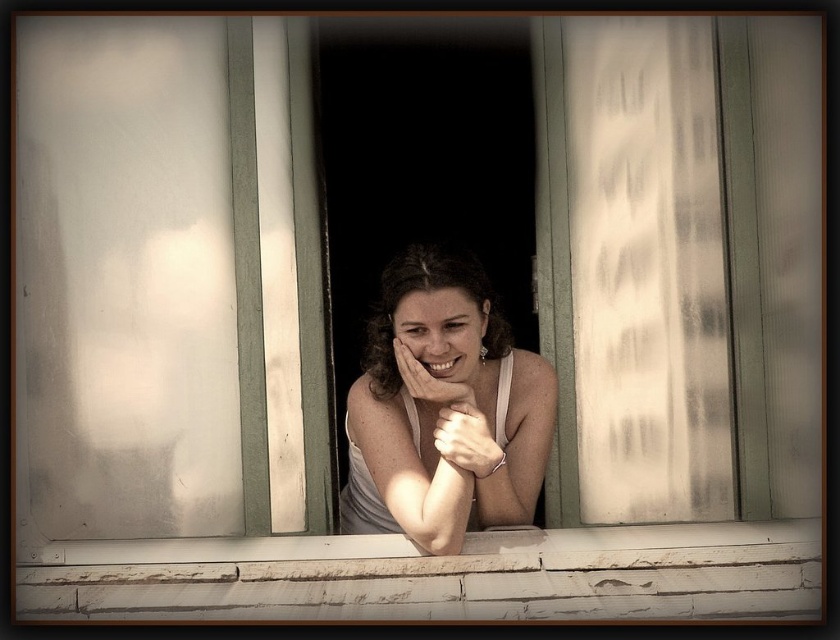
You are a photographer trying to capture the woman in the scene. You notice the matte white tank top at center and the matte silver bracelet at center. Which item is more visible in the photo due to its placement?

The matte white tank top at center is positioned over the matte silver bracelet at center, so the tank top is more visible in the photo.

You are an interior designer assessing the window area. You notice the white painted wood at center and the matte silver bracelet at center. Which object is taller in height?

The matte silver bracelet at center is taller than the white painted wood at center.

You are an architect analyzing the structural integrity of the window frame. Given that the white painted wood at center is positioned at coordinates point 0.900, 0.526, does this placement suggest it is part of the central support beam of the window frame?

The white painted wood at center is located at point (441,576), which aligns with the central area of the window frame, indicating it is likely part of the central support beam.